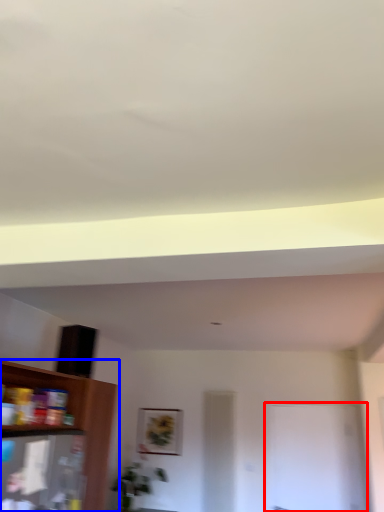
Question: Which of the following is the farthest to the observer, glass door (highlighted by a red box) or shelf (highlighted by a blue box)?

Choices:
 (A) glass door
 (B) shelf

Answer: (A)